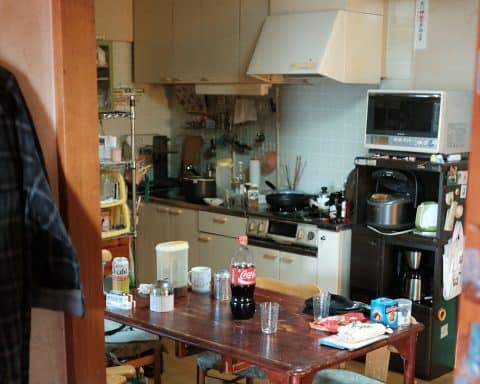
This screenshot has width=480, height=384. I want to click on coffee cup white, so click(x=198, y=282).